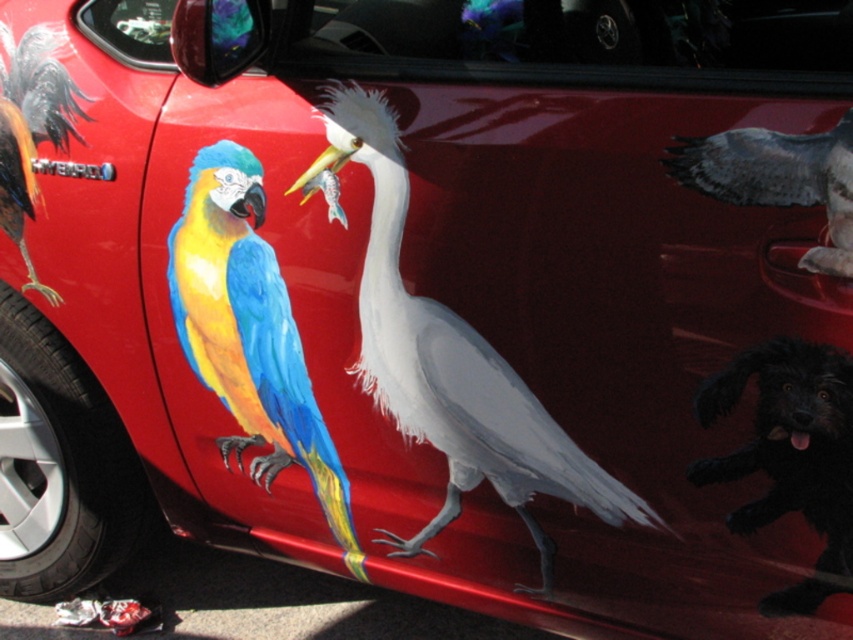
You are a painter who wants to add a new sticker to the car. The sticker is the same size as the black fuzzy dog at lower right. Where on the car can you place the sticker so it doesn t overlap with the white matte bird at center?

Since the white matte bird at center is larger than the black fuzzy dog at lower right, the sticker can be placed anywhere on the car except the area occupied by the white matte bird at center, ensuring it doesn t overlap. However, the exact placement depends on the car s available space not mentioned in the scene description.

You are a painter standing at the back of the car and want to paint a new bird between the white matte bird at center and the shiny metallic rooster at upper left. Is there enough vertical space between them to add another bird?

The white matte bird at center is positioned under the shiny metallic rooster at upper left, so there is vertical space between them. You can paint another bird between them.

You are a painter who wants to add a new sticker to the car. The sticker is 10 cm tall. You have to choose between placing it above the white matte bird at center or next to the black fuzzy dog at lower right. Which location has enough vertical space to accommodate the sticker without overlapping?

The white matte bird at center has a greater height compared to black fuzzy dog at lower right, so placing the sticker above the white matte bird at center would have more vertical space to accommodate the sticker without overlapping.